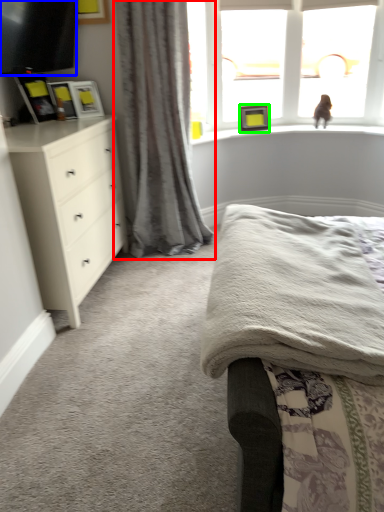
Question: Which is nearer to the curtain (highlighted by a red box)? television (highlighted by a blue box) or picture frame (highlighted by a green box).

Choices:
 (A) television
 (B) picture frame

Answer: (A)